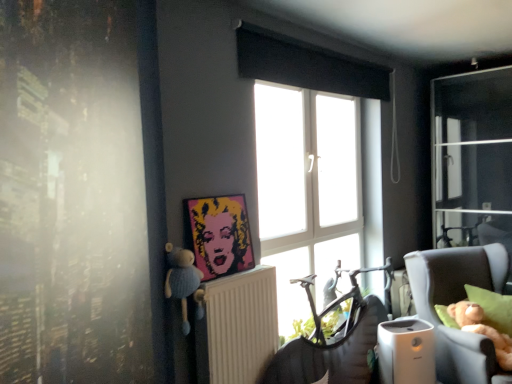
Question: Can you confirm if pop art portrait at center is shorter than white plastic radiator at center?

Choices:
 (A) no
 (B) yes

Answer: (B)

Question: Considering the relative sizes of pop art portrait at center and white plastic radiator at center in the image provided, is pop art portrait at center smaller than white plastic radiator at center?

Choices:
 (A) no
 (B) yes

Answer: (B)

Question: Is pop art portrait at center positioned behind white plastic radiator at center?

Choices:
 (A) yes
 (B) no

Answer: (A)

Question: Considering the relative sizes of pop art portrait at center and white plastic radiator at center in the image provided, is pop art portrait at center wider than white plastic radiator at center?

Choices:
 (A) yes
 (B) no

Answer: (B)

Question: From a real-world perspective, is pop art portrait at center located beneath white plastic radiator at center?

Choices:
 (A) yes
 (B) no

Answer: (B)

Question: Choose the correct answer: Is plush blue bear at left inside white plastic radiator at center or outside it?

Choices:
 (A) outside
 (B) inside

Answer: (A)

Question: Relative to white plastic radiator at center, is plush blue bear at left in front or behind?

Choices:
 (A) behind
 (B) front

Answer: (B)

Question: From a real-world perspective, relative to white plastic radiator at center, is plush blue bear at left vertically above or below?

Choices:
 (A) below
 (B) above

Answer: (B)

Question: Is point (190, 266) positioned closer to the camera than point (252, 357)?

Choices:
 (A) farther
 (B) closer

Answer: (B)

Question: Relative to white glass window at center, is plush blue bear at left in front or behind?

Choices:
 (A) front
 (B) behind

Answer: (A)

Question: In the image, is plush blue bear at left on the left side or the right side of white glass window at center?

Choices:
 (A) left
 (B) right

Answer: (A)

Question: Is point (189, 256) closer or farther from the camera than point (282, 334)?

Choices:
 (A) closer
 (B) farther

Answer: (A)

Question: From a real-world perspective, relative to white glass window at center, is plush blue bear at left vertically above or below?

Choices:
 (A) below
 (B) above

Answer: (A)

Question: Considering the positions of beige fabric chair at right and pop art portrait at center in the image, is beige fabric chair at right wider or thinner than pop art portrait at center?

Choices:
 (A) thin
 (B) wide

Answer: (B)

Question: In the image, is beige fabric chair at right positioned in front of or behind pop art portrait at center?

Choices:
 (A) behind
 (B) front

Answer: (A)